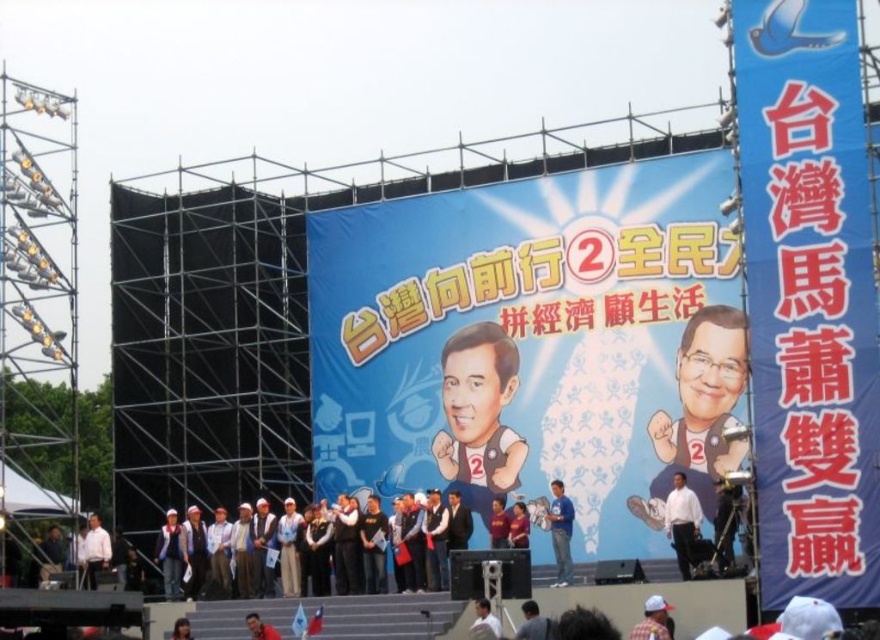
You are attending a political rally in Taiwan and notice two shirts at the center of the stage. The white glossy shirt at center and the matte yellow shirt at center. Which shirt is positioned to the right of the other?

The white glossy shirt at center is to the right of the matte yellow shirt at center.

You are a photographer at the event and want to capture both the matte yellow shirt at center and the white shirt at center in a single photo. Which shirt should you position on the left side of your frame to ensure both are visible?

To include both the matte yellow shirt at center and the white shirt at center in the photo, position the white shirt at center on the left side of the frame since the matte yellow shirt at center is already on the right side of the white shirt at center.

You are a photographer at the rally and need to capture both the white glossy shirt at center and the matte yellow shirt at center in a single frame. Given that your camera has a fixed focal length, which shirt should you focus on to ensure both are in the frame without cropping?

You should focus on the white glossy shirt at center because its width is larger than the matte yellow shirt at center, ensuring it occupies more space and allows the smaller matte yellow shirt at center to fit within the frame.